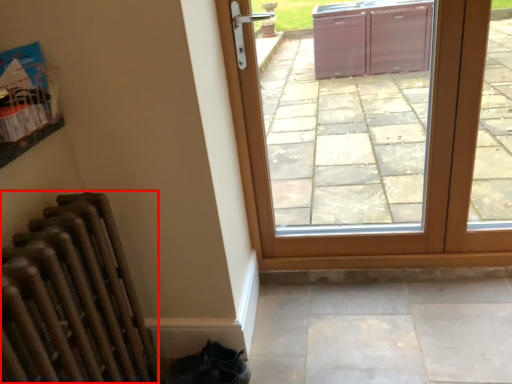
Question: From the image's perspective, considering the relative positions of radiator (annotated by the red box) and door in the image provided, where is radiator (annotated by the red box) located with respect to the staircase?

Choices:
 (A) above
 (B) below

Answer: (B)